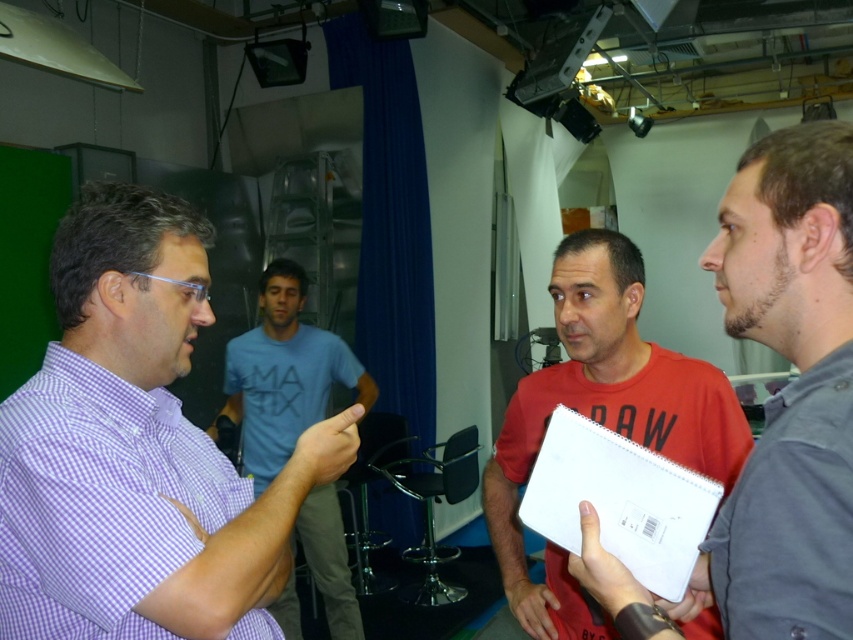
Question: Is purple checkered shirt at left in front of matte blue shirt at center?

Choices:
 (A) yes
 (B) no

Answer: (A)

Question: Which of these objects is positioned farthest from the matte gray notebook at center?

Choices:
 (A) matte blue shirt at center
 (B) red matte shirt at center
 (C) purple checkered shirt at left

Answer: (A)

Question: Does purple checkered shirt at left appear over matte gray notebook at center?

Choices:
 (A) no
 (B) yes

Answer: (B)

Question: Estimate the real-world distances between objects in this image. Which object is farther from the matte blue shirt at center?

Choices:
 (A) purple checkered shirt at left
 (B) red matte shirt at center
 (C) matte gray notebook at center

Answer: (C)

Question: Which object is the farthest from the matte gray notebook at center?

Choices:
 (A) purple checkered shirt at left
 (B) matte blue shirt at center

Answer: (B)

Question: Does purple checkered shirt at left have a lesser width compared to matte blue shirt at center?

Choices:
 (A) yes
 (B) no

Answer: (A)